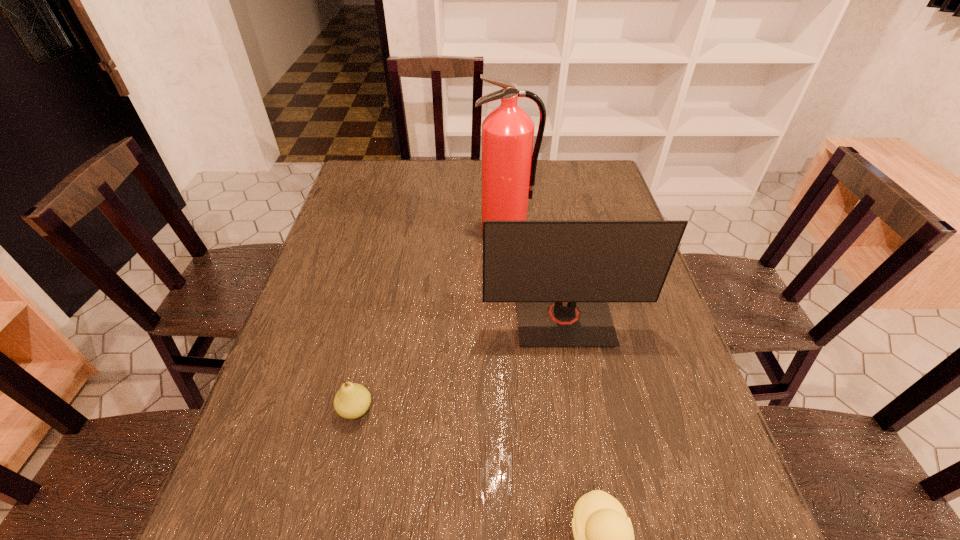
What are the coordinates of `the tallest object` in the screenshot? It's located at (508, 166).

Find the location of a particular element. the farthest object is located at coordinates (508, 166).

The height and width of the screenshot is (540, 960). In order to click on the third nearest object in this screenshot , I will do `click(561, 274)`.

Where is `monitor`? The height and width of the screenshot is (540, 960). monitor is located at coordinates (561, 274).

This screenshot has width=960, height=540. Find the location of `the third farthest object`. the third farthest object is located at coordinates (352, 400).

This screenshot has height=540, width=960. I want to click on the leftmost object, so click(352, 400).

At what (x,y) coordinates should I click in order to perform the action: click on free location located 0.320m at the nozzle of the farthest object. Please return your answer as a coordinate pair (x, y). Looking at the image, I should click on (513, 325).

Locate an element on the screen. Image resolution: width=960 pixels, height=540 pixels. vacant space located 0.290m on the screen side of the second tallest object is located at coordinates (591, 475).

Where is `vacant space located on the front of the pear`? vacant space located on the front of the pear is located at coordinates (333, 511).

What are the coordinates of `object that is at the right edge` in the screenshot? It's located at (561, 274).